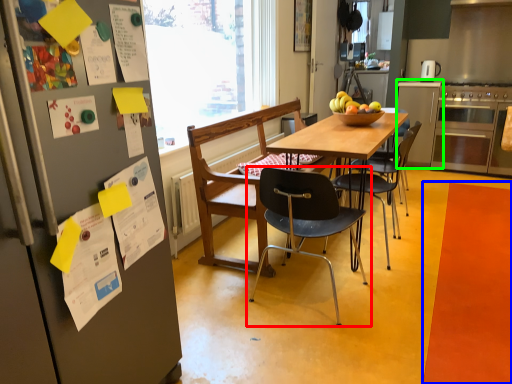
Question: Estimate the real-world distances between objects in this image. Which object is closer to chair (highlighted by a red box), mat (highlighted by a blue box) or cabinetry (highlighted by a green box)?

Choices:
 (A) mat
 (B) cabinetry

Answer: (A)